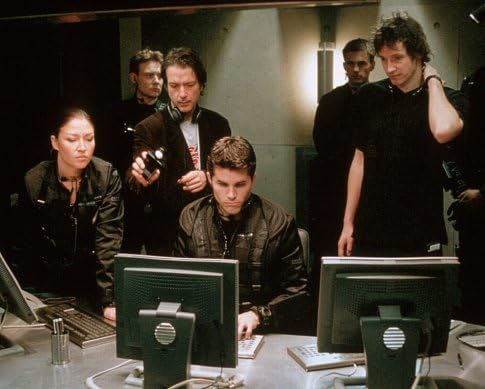
The width and height of the screenshot is (485, 389). What are the coordinates of `tabletop metallic` in the screenshot? It's located at (280, 366).